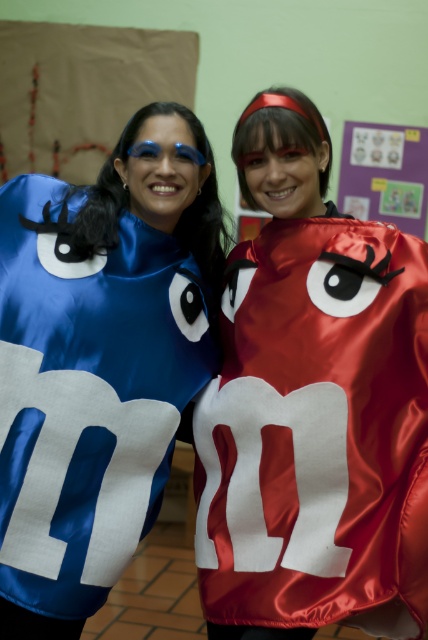
Looking at this image, you are standing in front of a bulletin board in a classroom and want to take a photo of the point at coordinate point (330, 248). The camera you are using has a focal length of 50mm and a sensor size of 24mm. What is the minimum distance you need to stand away from the point to ensure the entire scene fits in the frame?

The minimum distance required is approximately 1.78 meters to ensure the entire scene fits in the frame.